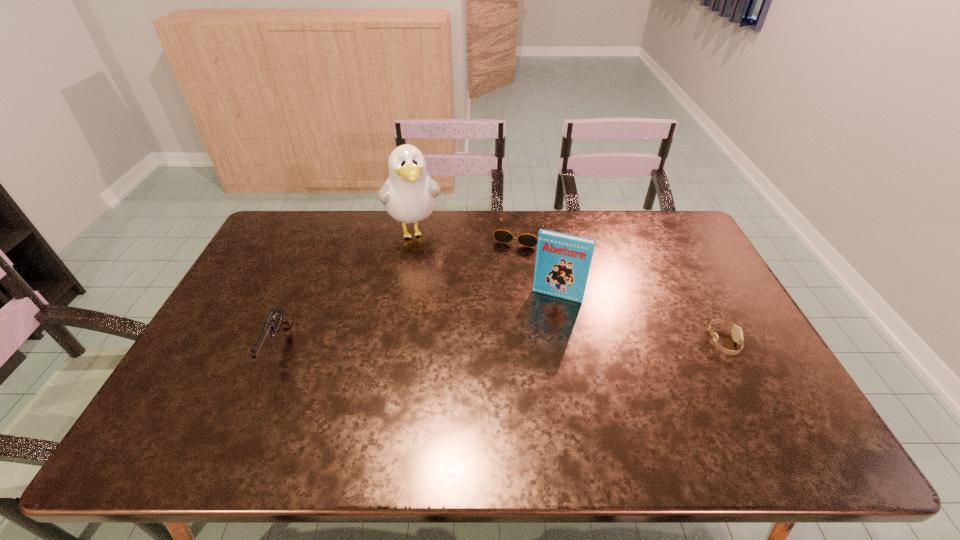
At what (x,y) coordinates should I click in order to perform the action: click on vacant spot on the desktop that is between the leftmost object and the watch and is positioned on the front-facing side of the sunglasses. Please return your answer as a coordinate pair (x, y). Looking at the image, I should click on (481, 345).

This screenshot has height=540, width=960. Identify the location of free space on the desktop that is between the third tallest object and the watch and is positioned on the beak of the tallest object. (443, 345).

You are a GUI agent. You are given a task and a screenshot of the screen. Output one action in this format:
    pyautogui.click(x=<x>, y=<y>)
    Task: Click on the free space on the desktop that is between the leftmost object and the watch and is positioned on the front cover of the book
    
    Given the screenshot: What is the action you would take?
    pyautogui.click(x=541, y=344)